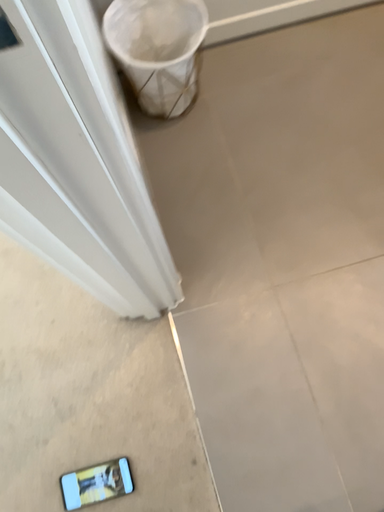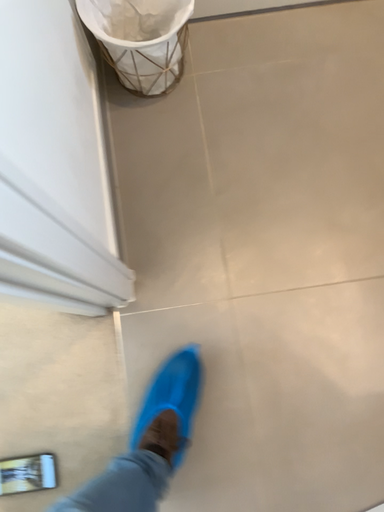
Question: How did the camera likely rotate when shooting the video?

Choices:
 (A) rotated upward
 (B) rotated downward

Answer: (B)